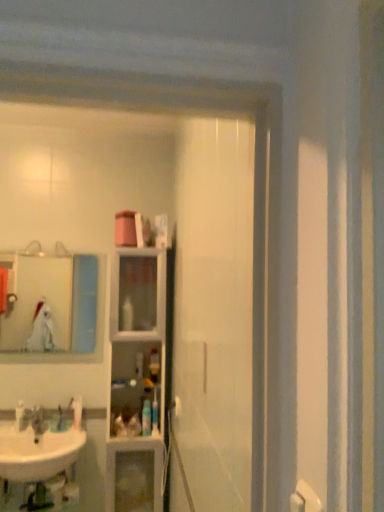
Question: From the image's perspective, is matte glass mirror at upper left positioned above or below brushed metal faucet at lower left?

Choices:
 (A) above
 (B) below

Answer: (A)

Question: In terms of size, does matte glass mirror at upper left appear bigger or smaller than brushed metal faucet at lower left?

Choices:
 (A) big
 (B) small

Answer: (A)

Question: Which is nearer to the clear glass cabinet at center?

Choices:
 (A) white glossy sink at lower left
 (B) translucent plastic bottle at center, the 5th toiletry positioned from the left
 (C) translucent plastic bottle at center, the 4th toiletry positioned from the left
 (D) white glossy toothpaste tube at center, the second toiletry from the left
 (E) matte glass mirror at upper left

Answer: (B)

Question: Estimate the real-world distances between objects in this image. Which object is closer to the white glossy sink at lower left?

Choices:
 (A) translucent plastic bottle at center, the 5th toiletry positioned from the left
 (B) brushed metal faucet at lower left
 (C) matte glass mirror at upper left
 (D) clear glass cabinet at center
 (E) white glossy toothbrush at lower left, which is counted as the first toiletry, starting from the left

Answer: (B)